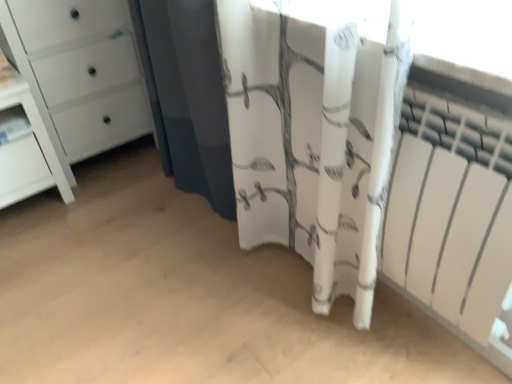
Where is `free spot in front of white floral fabric at center`? This screenshot has height=384, width=512. free spot in front of white floral fabric at center is located at coordinates (155, 258).